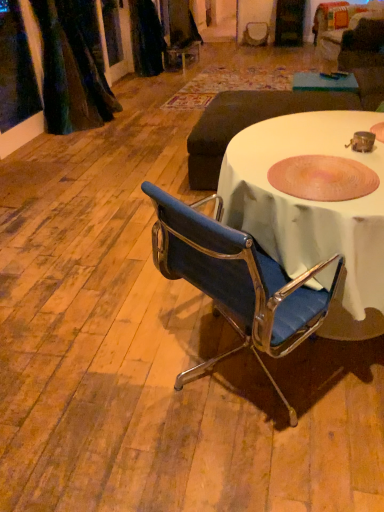
The height and width of the screenshot is (512, 384). What are the coordinates of `vacant space that is to the left of blue fabric chair at center` in the screenshot? It's located at (96, 306).